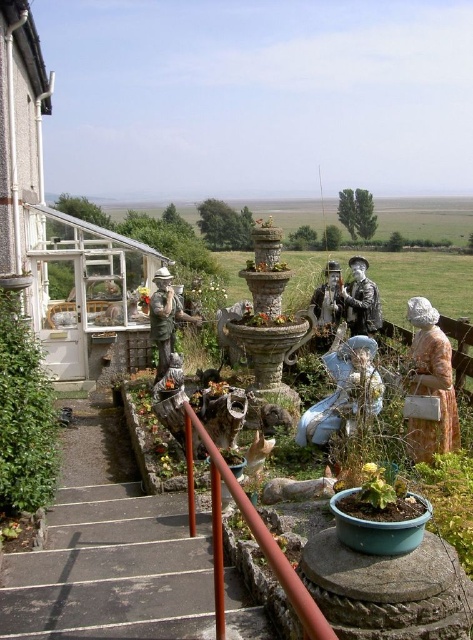
Question: Among these objects, which one is nearest to the camera?

Choices:
 (A) metallic red handrail at center
 (B) concrete steps at lower left

Answer: (A)

Question: Observing the image, what is the correct spatial positioning of matte bronze statue at center-left in reference to shiny silver statue at center?

Choices:
 (A) right
 (B) left

Answer: (B)

Question: Can you confirm if green leafy bush at lower left is positioned above shiny silver statue at center?

Choices:
 (A) yes
 (B) no

Answer: (B)

Question: Which of these objects is positioned farthest from the metallic red handrail at center?

Choices:
 (A) matte orange dress at right
 (B) matte bronze statue at center

Answer: (B)

Question: Can you confirm if green leafy bush at lower left is wider than matte bronze statue at center?

Choices:
 (A) no
 (B) yes

Answer: (B)

Question: Among these objects, which one is farthest from the camera?

Choices:
 (A) metallic red handrail at center
 (B) shiny silver statue at center
 (C) porcelain statue at center
 (D) matte orange dress at right

Answer: (B)